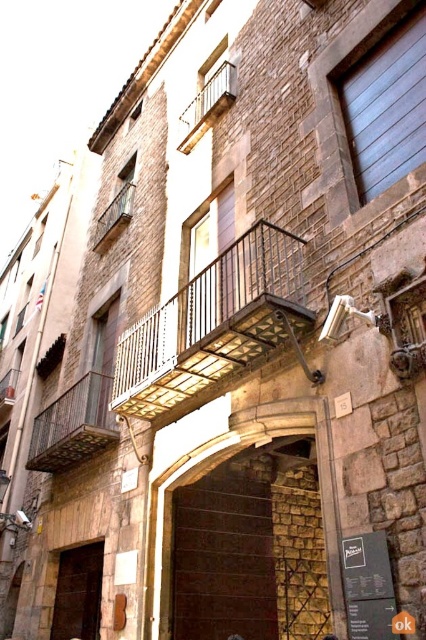
You are standing in front of the historic building and want to take a photo of the metallic wrought iron balcony at center. Where should you position yourself to capture it in the center of your camera viewfinder?

To capture the metallic wrought iron balcony at center in the center of your camera viewfinder, position yourself directly in front of the building at the point corresponding to coordinates (213, 323).